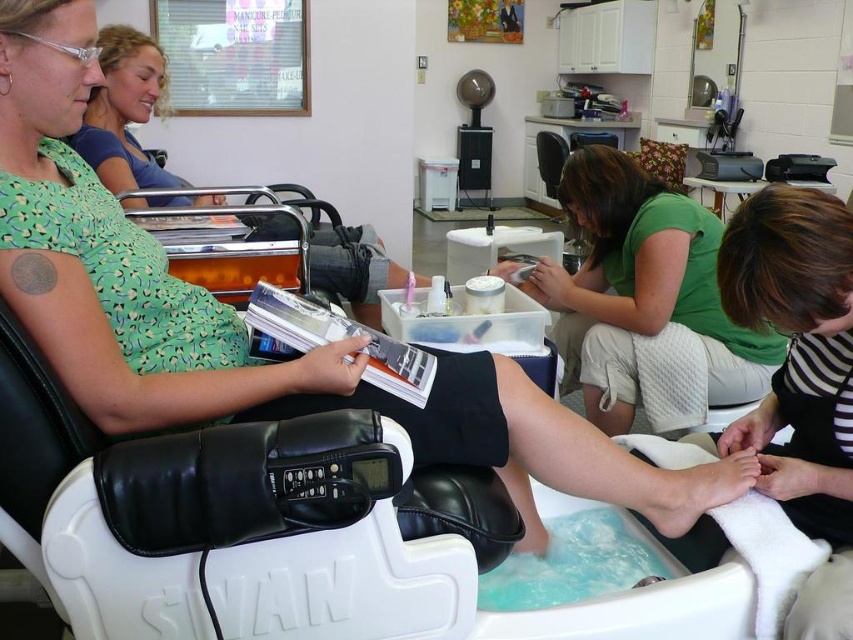
Does point (631, 374) lie behind point (318, 285)?

That is False.

Does green matte shirt at center come in front of green matte dress at upper left?

Yes, green matte shirt at center is in front of green matte dress at upper left.

Is point (585, 323) positioned before point (131, 49)?

Yes, it is.

Locate an element on the screen. The width and height of the screenshot is (853, 640). green matte shirt at center is located at coordinates (647, 301).